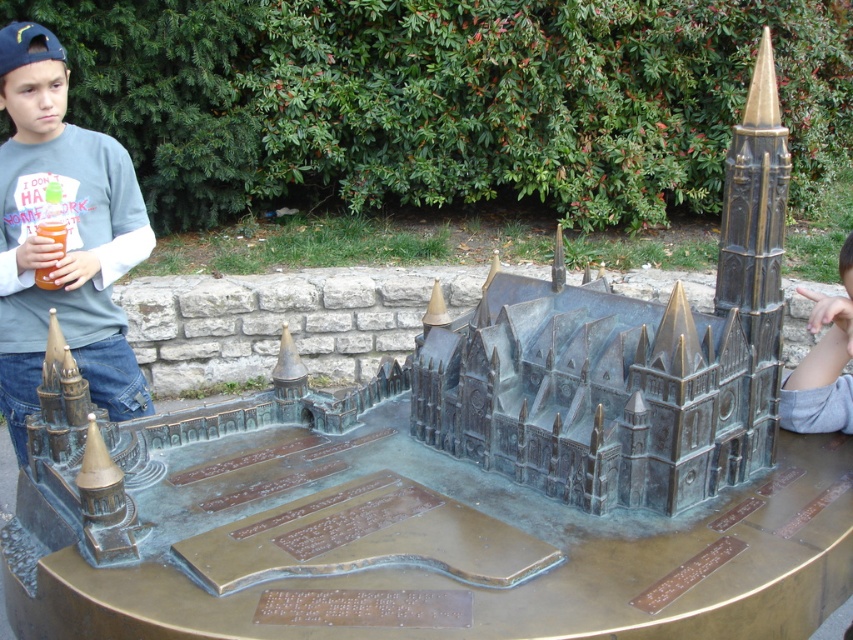
Is gray fabric hand at lower right wider than translucent plastic cup at left?

Yes, gray fabric hand at lower right is wider than translucent plastic cup at left.

Is gray fabric hand at lower right further to the viewer compared to translucent plastic cup at left?

No, gray fabric hand at lower right is closer to the viewer.

Who is more forward, (x=824, y=304) or (x=54, y=236)?

Point (x=824, y=304) is more forward.

The image size is (853, 640). I want to click on gray fabric hand at lower right, so pos(822,362).

Can you confirm if matte gray shirt at left is thinner than gray fabric hand at lower right?

No.

Does point (132, 220) lie behind point (842, 324)?

Yes, it is.

What are the coordinates of `matte gray shirt at left` in the screenshot? It's located at (67, 237).

Which is more to the right, matte gray shirt at left or translucent plastic cup at left?

Positioned to the right is matte gray shirt at left.

From the picture: Is matte gray shirt at left positioned at the back of translucent plastic cup at left?

No, matte gray shirt at left is closer to the viewer.

Where is `matte gray shirt at left`? The height and width of the screenshot is (640, 853). matte gray shirt at left is located at coordinates (67, 237).